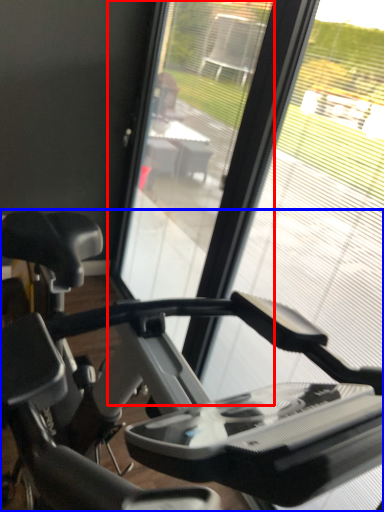
Question: Which object is further to the camera taking this photo, screen door (highlighted by a red box) or stationary bicycle (highlighted by a blue box)?

Choices:
 (A) screen door
 (B) stationary bicycle

Answer: (A)